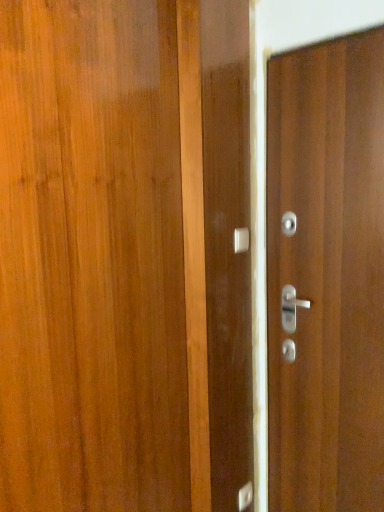
Question: Can satin silver door handle at center, placed as the 2th door handle when sorted from front to back, be found inside satin silver door handle at center, the 1th door handle from the front?

Choices:
 (A) no
 (B) yes

Answer: (A)

Question: Does satin silver door handle at center, the first door handle in the top-to-bottom sequence, have a larger size compared to satin silver door handle at center, the second door handle viewed from the top?

Choices:
 (A) yes
 (B) no

Answer: (A)

Question: From the image's perspective, is satin silver door handle at center, the 2th door handle ordered from the bottom, on satin silver door handle at center, the second door handle viewed from the top?

Choices:
 (A) yes
 (B) no

Answer: (A)

Question: Does satin silver door handle at center, the first door handle in the top-to-bottom sequence, come behind satin silver door handle at center, the second door handle viewed from the top?

Choices:
 (A) no
 (B) yes

Answer: (A)

Question: Considering the relative sizes of satin silver door handle at center, the first door handle in the top-to-bottom sequence, and satin silver door handle at center, the second door handle viewed from the top, in the image provided, is satin silver door handle at center, the first door handle in the top-to-bottom sequence, shorter than satin silver door handle at center, the second door handle viewed from the top,?

Choices:
 (A) no
 (B) yes

Answer: (B)

Question: Is point (236, 252) positioned closer to the camera than point (278, 370)?

Choices:
 (A) farther
 (B) closer

Answer: (B)

Question: Relative to wooden door at right, is satin silver door handle at center, the first door handle in the top-to-bottom sequence, in front or behind?

Choices:
 (A) behind
 (B) front

Answer: (A)

Question: In terms of width, does satin silver door handle at center, the 2th door handle ordered from the bottom, look wider or thinner when compared to wooden door at right?

Choices:
 (A) thin
 (B) wide

Answer: (A)

Question: From the image's perspective, is satin silver door handle at center, which is the second door handle from back to front, located above or below wooden door at right?

Choices:
 (A) above
 (B) below

Answer: (A)

Question: From a real-world perspective, relative to wooden door at right, is satin silver door handle at center, placed as the first door handle when sorted from back to front, vertically above or below?

Choices:
 (A) below
 (B) above

Answer: (A)

Question: Visually, is satin silver door handle at center, acting as the 1th door handle starting from the bottom, positioned to the left or to the right of wooden door at right?

Choices:
 (A) right
 (B) left

Answer: (B)

Question: From the image's perspective, is satin silver door handle at center, placed as the first door handle when sorted from back to front, above or below wooden door at right?

Choices:
 (A) below
 (B) above

Answer: (A)

Question: Is satin silver door handle at center, placed as the 2th door handle when sorted from front to back, bigger or smaller than wooden door at right?

Choices:
 (A) small
 (B) big

Answer: (A)

Question: Is wooden door at right inside or outside of satin silver door handle at center, the first door handle in the top-to-bottom sequence?

Choices:
 (A) inside
 (B) outside

Answer: (B)

Question: Is wooden door at right in front of or behind satin silver door handle at center, the 1th door handle from the front, in the image?

Choices:
 (A) behind
 (B) front

Answer: (B)